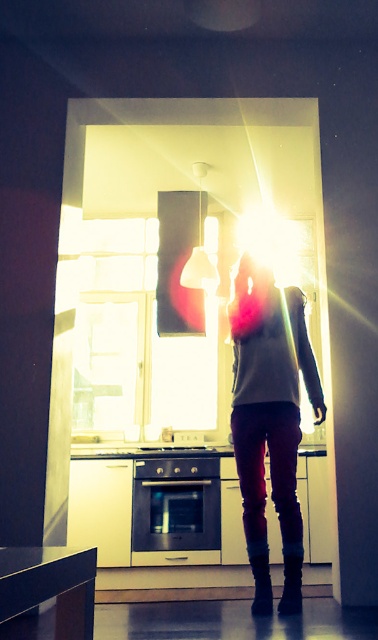
Can you confirm if matte gray sweater at center is positioned above leather boot at lower center?

Yes, matte gray sweater at center is above leather boot at lower center.

Who is more distant from viewer, (249, 355) or (261, 589)?

The point (249, 355) is behind.

Locate an element on the screen. This screenshot has height=640, width=378. matte gray sweater at center is located at coordinates (269, 397).

Is point (187, 538) farther from camera compared to point (260, 541)?

That is True.

Which is behind, point (218, 512) or point (266, 604)?

Positioned behind is point (218, 512).

The width and height of the screenshot is (378, 640). I want to click on metallic oven at center, so click(176, 504).

Between leather boot at lower center and black suede boot at lower center, which one appears on the left side from the viewer's perspective?

From the viewer's perspective, leather boot at lower center appears more on the left side.

The width and height of the screenshot is (378, 640). What do you see at coordinates (260, 579) in the screenshot?
I see `leather boot at lower center` at bounding box center [260, 579].

Locate an element on the screen. Image resolution: width=378 pixels, height=640 pixels. leather boot at lower center is located at coordinates (260, 579).